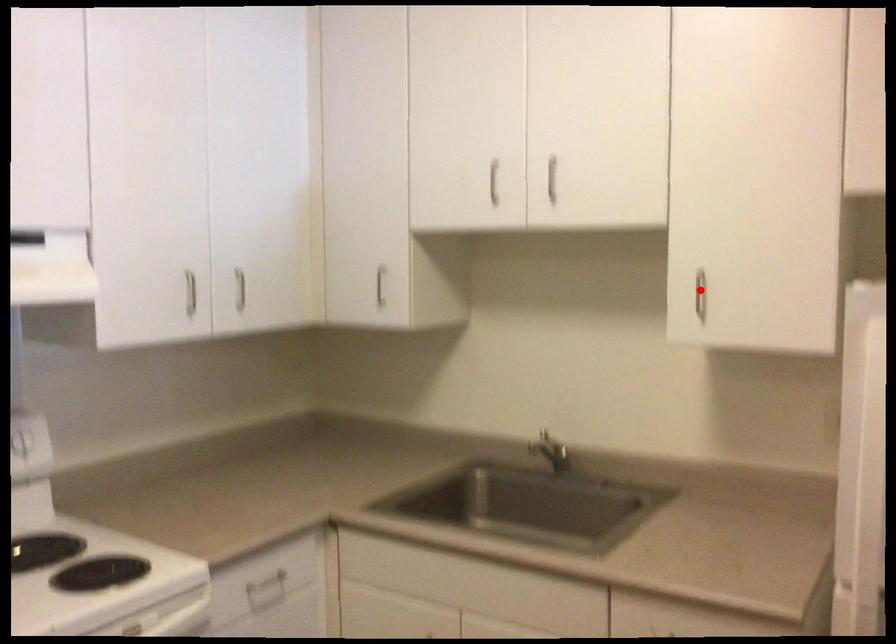
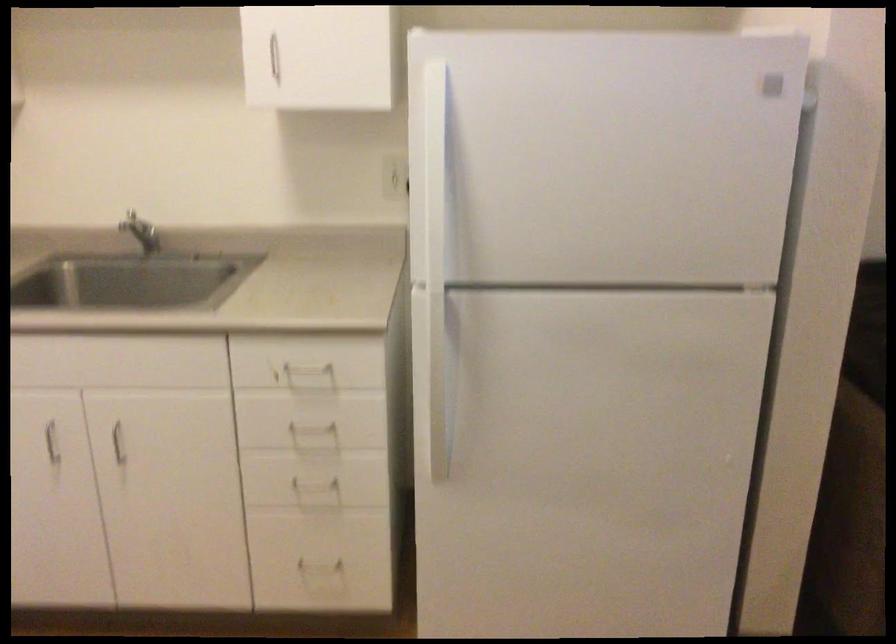
Where in the second image is the point corresponding to the highlighted location from the first image?

(270, 59)